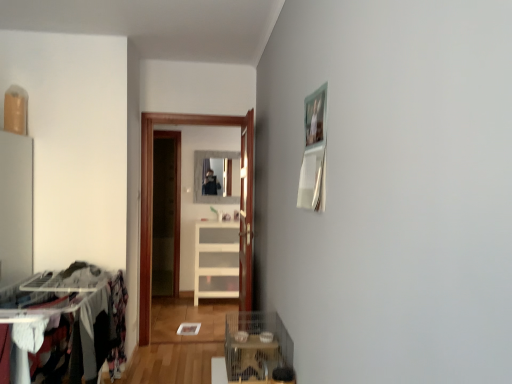
Question: Should I look upward or downward to see wooden door at center?

Choices:
 (A) up
 (B) down

Answer: (B)

Question: Is wooden door at center turned away from metallic wire cage at lower center?

Choices:
 (A) no
 (B) yes

Answer: (A)

Question: Can you confirm if wooden door at center is taller than metallic wire cage at lower center?

Choices:
 (A) no
 (B) yes

Answer: (B)

Question: Considering the relative positions of wooden door at center and metallic wire cage at lower center in the image provided, is wooden door at center in front of metallic wire cage at lower center?

Choices:
 (A) yes
 (B) no

Answer: (B)

Question: Does wooden door at center have a lesser height compared to metallic wire cage at lower center?

Choices:
 (A) yes
 (B) no

Answer: (B)

Question: Does wooden door at center lie behind metallic wire cage at lower center?

Choices:
 (A) no
 (B) yes

Answer: (B)

Question: From the image's perspective, would you say wooden door at center is shown under metallic wire cage at lower center?

Choices:
 (A) no
 (B) yes

Answer: (A)

Question: Would you say white marble mirror at center is part of wooden door at center's contents?

Choices:
 (A) no
 (B) yes

Answer: (A)

Question: Is wooden door at center facing towards white marble mirror at center?

Choices:
 (A) yes
 (B) no

Answer: (B)

Question: Is wooden door at center next to white marble mirror at center and touching it?

Choices:
 (A) yes
 (B) no

Answer: (B)

Question: From a real-world perspective, is wooden door at center positioned under white marble mirror at center based on gravity?

Choices:
 (A) yes
 (B) no

Answer: (A)

Question: Considering the relative sizes of wooden door at center and white marble mirror at center in the image provided, is wooden door at center thinner than white marble mirror at center?

Choices:
 (A) yes
 (B) no

Answer: (B)

Question: Is the depth of wooden door at center less than that of white marble mirror at center?

Choices:
 (A) no
 (B) yes

Answer: (B)

Question: Is transparent glass door at center taller than metallic wire cage at lower center?

Choices:
 (A) no
 (B) yes

Answer: (B)